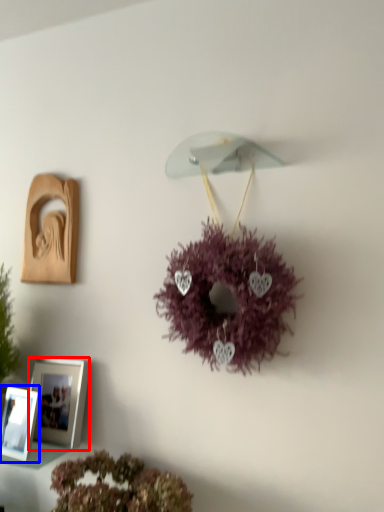
Question: Which object is further to the camera taking this photo, picture frame (highlighted by a red box) or picture frame (highlighted by a blue box)?

Choices:
 (A) picture frame
 (B) picture frame

Answer: (A)